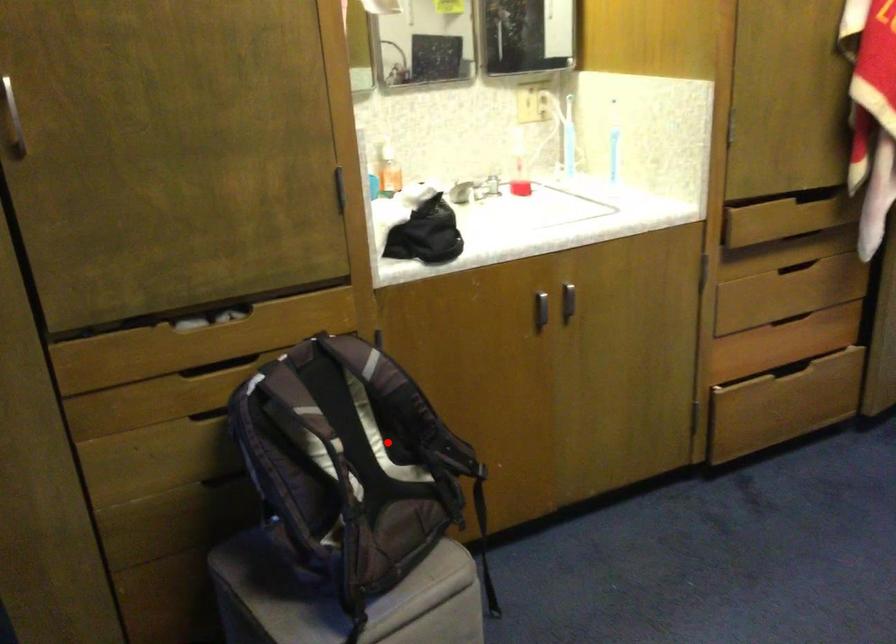
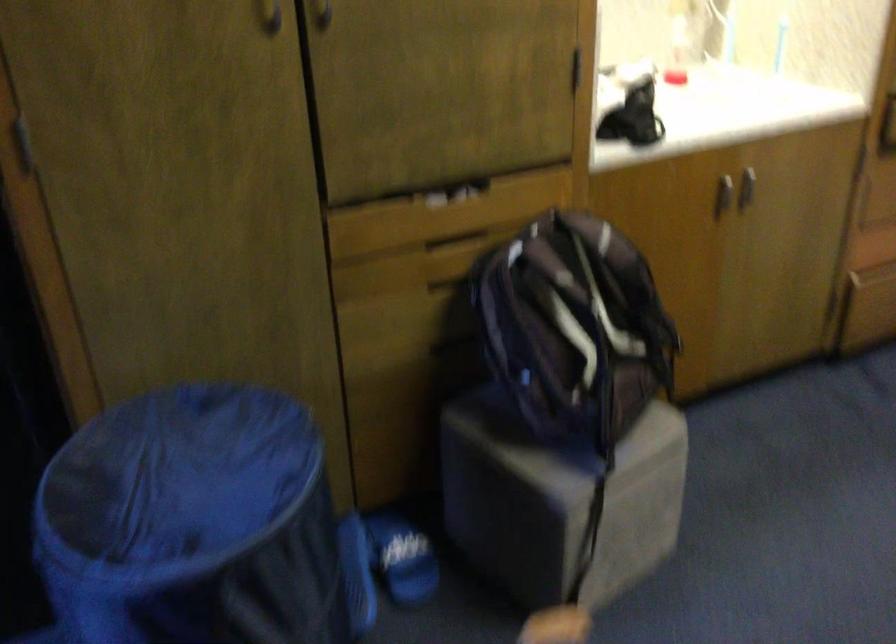
Where in the second image is the point corresponding to the highlighted location from the first image?

(607, 310)